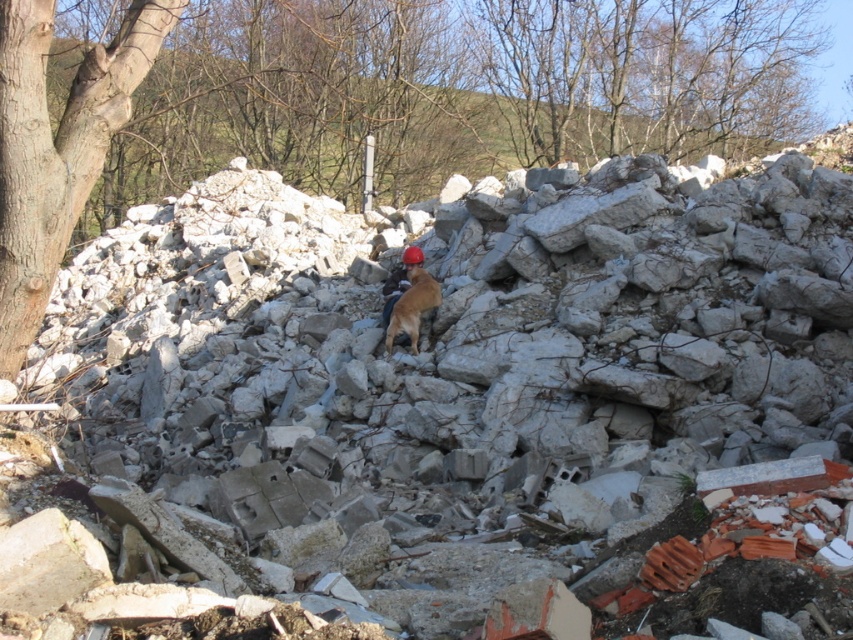
You are a construction worker looking for a safe path to reach the brown furry dog at center. The smooth brown tree trunk at left is blocking your way. Can you walk around it to reach the dog?

The smooth brown tree trunk at left is in front of the brown furry dog at center, so you can walk around it to reach the dog.

You are standing at the center of the rubble pile and see the point marked at coordinates (56, 147). What object is located at that point?

The smooth brown tree trunk at left is located at point (56, 147).

You are a safety inspector standing near the rubble pile. You notice the smooth brown tree trunk at left and the matte orange helmet at center. Which object is closer to you?

The smooth brown tree trunk at left is closer to you because it is in front of the matte orange helmet at center.